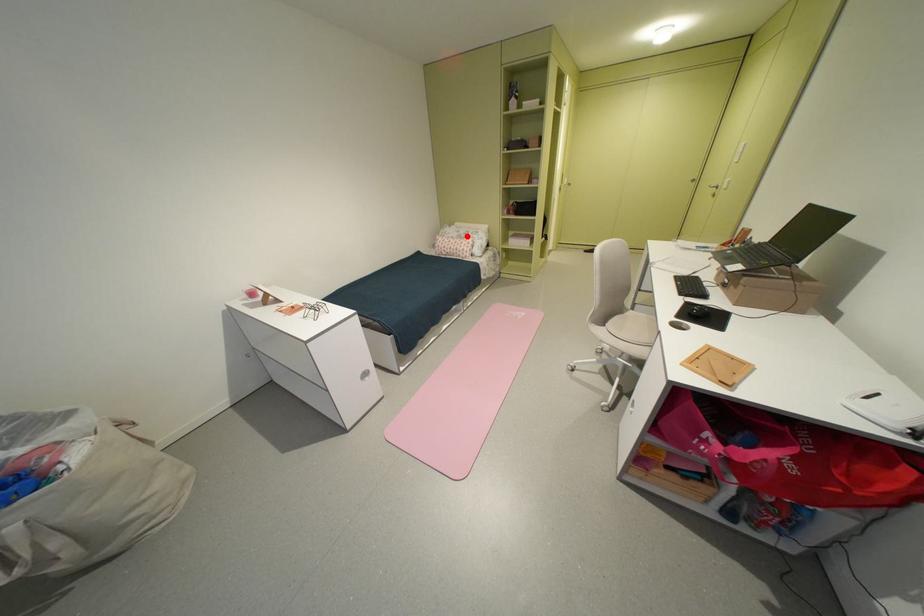
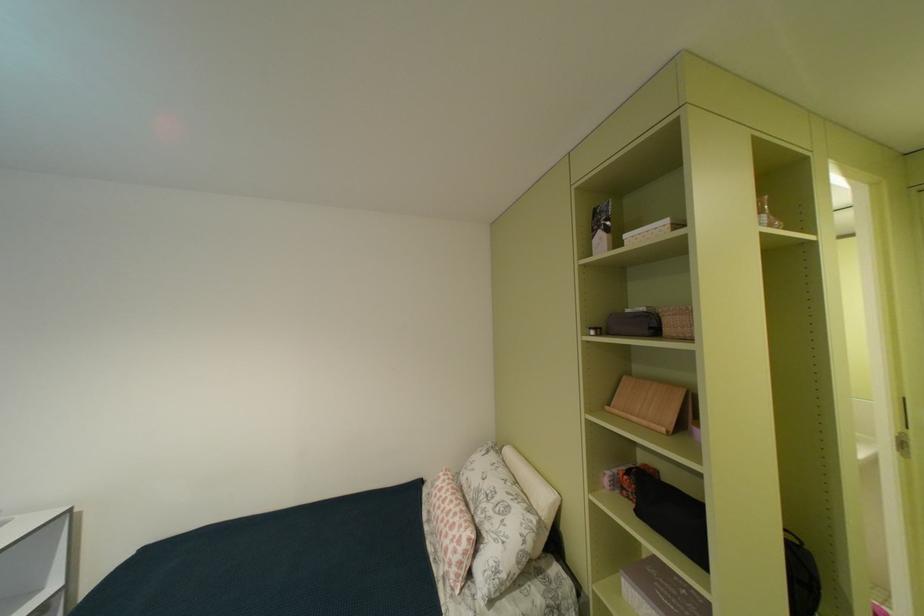
The point at the highlighted location is marked in the first image. Where is the corresponding point in the second image?

(487, 487)